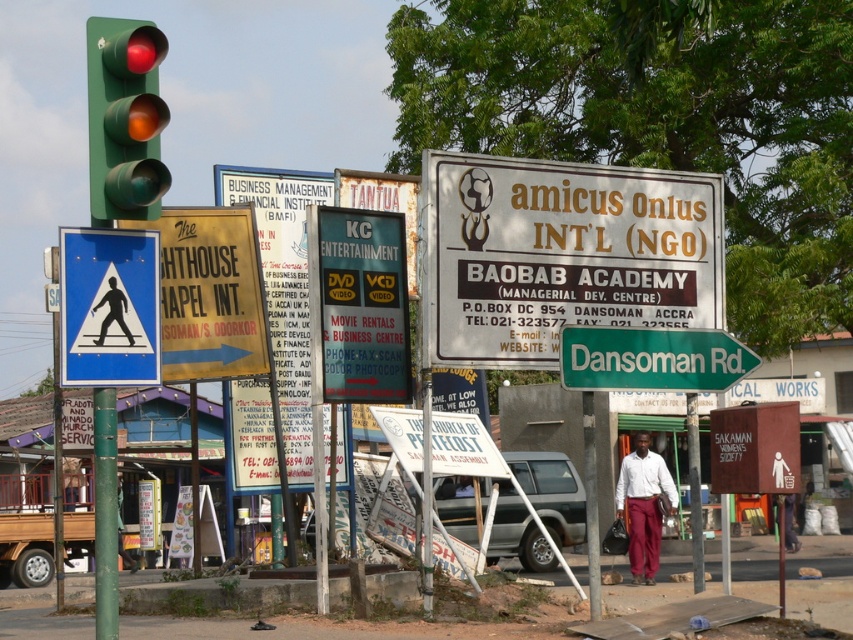
You are a city planner analyzing this street scene. You need to determine which object is taller between the blue plastic pedestrian crossing sign at left and the green metallic signpost at right. Based on the scene, which one is taller?

The blue plastic pedestrian crossing sign at left is taller than the green metallic signpost at right.

You are a delivery person carrying a box that is 3 meters long. You need to pass between the blue plastic pedestrian crossing sign at left and the green metallic signpost at right. Can your box fit through the space between them?

The blue plastic pedestrian crossing sign at left and green metallic signpost at right are 5.41 meters apart from each other. Since the box is 3 meters long, it can fit through the space between them as the distance is greater than the box length.

You are a delivery person needing to attach a large package to the tallest object between the matte black signboard at center and the green metallic signpost at right. Which object should you choose?

The matte black signboard at center is taller than the green metallic signpost at right, so you should attach the package to the matte black signboard at center.